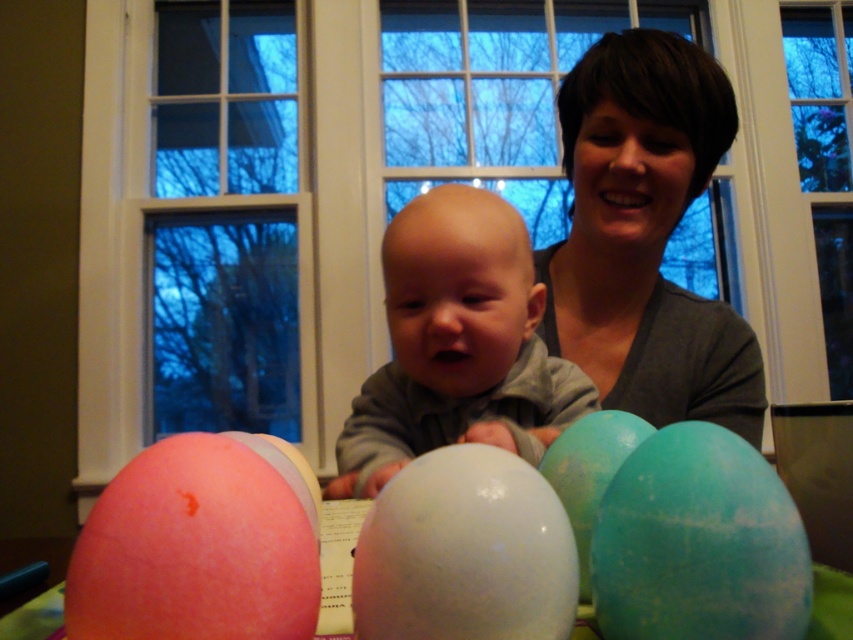
Question: From the image, what is the correct spatial relationship of matte gray sweater at upper center in relation to green matte balloon at center?

Choices:
 (A) left
 (B) right

Answer: (B)

Question: Which is farther from the matte gray sweater at upper center?

Choices:
 (A) green matte balloon at center
 (B) matte teal balloon at center right

Answer: (A)

Question: Does matte pink balloon at lower left have a lesser width compared to matte teal balloon at center right?

Choices:
 (A) no
 (B) yes

Answer: (A)

Question: Does green matte balloon at center have a smaller size compared to white glossy balloon at center?

Choices:
 (A) yes
 (B) no

Answer: (B)

Question: Which point is farther from the camera taking this photo?

Choices:
 (A) (361, 602)
 (B) (664, 385)
 (C) (703, 461)

Answer: (B)

Question: Which point appears farthest from the camera in this image?

Choices:
 (A) (514, 568)
 (B) (136, 502)
 (C) (498, 330)
 (D) (589, 512)

Answer: (C)